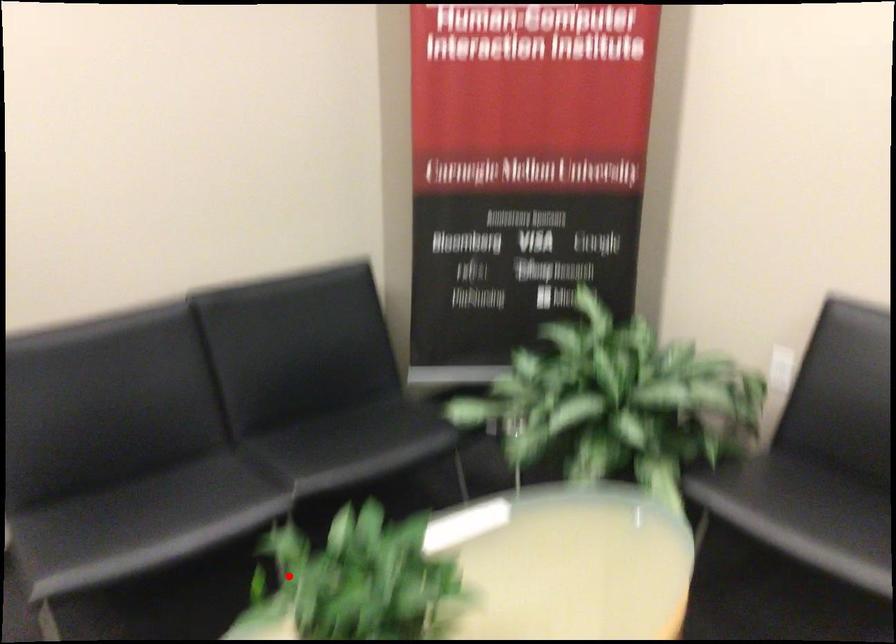
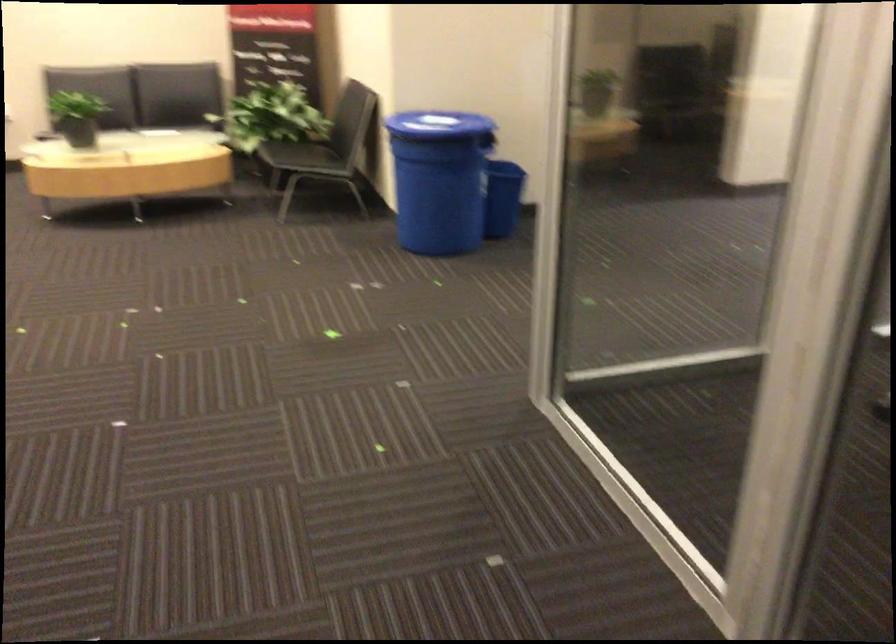
Question: I am providing you with two images of the same scene from different viewpoints. Given a red point in image1, look at the same physical point in image2. Is it:

Choices:
 (A) Closer to the viewpoint
 (B) Farther from the viewpoint

Answer: (B)